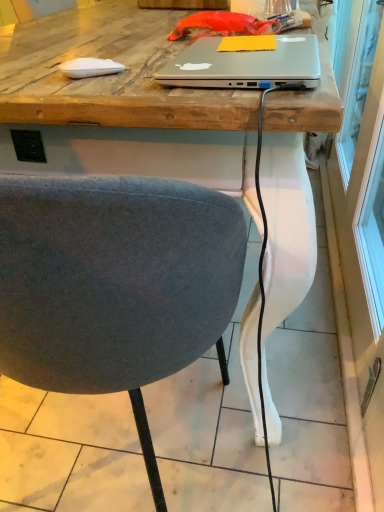
Question: Does textured gray chair at center come behind satin silver laptop at center?

Choices:
 (A) yes
 (B) no

Answer: (B)

Question: From a real-world perspective, does textured gray chair at center stand above satin silver laptop at center?

Choices:
 (A) no
 (B) yes

Answer: (A)

Question: Is textured gray chair at center to the left of satin silver laptop at center from the viewer's perspective?

Choices:
 (A) no
 (B) yes

Answer: (B)

Question: Is textured gray chair at center not within satin silver laptop at center?

Choices:
 (A) no
 (B) yes

Answer: (B)

Question: Does textured gray chair at center appear on the right side of satin silver laptop at center?

Choices:
 (A) no
 (B) yes

Answer: (A)

Question: Does point (288, 79) appear closer or farther from the camera than point (44, 247)?

Choices:
 (A) farther
 (B) closer

Answer: (A)

Question: From a real-world perspective, relative to textured gray chair at center, is satin silver laptop at center vertically above or below?

Choices:
 (A) below
 (B) above

Answer: (B)

Question: Considering their positions, is satin silver laptop at center located in front of or behind textured gray chair at center?

Choices:
 (A) front
 (B) behind

Answer: (B)

Question: Considering the positions of satin silver laptop at center and textured gray chair at center in the image, is satin silver laptop at center bigger or smaller than textured gray chair at center?

Choices:
 (A) small
 (B) big

Answer: (A)

Question: Does point (226, 68) appear closer or farther from the camera than point (364, 311)?

Choices:
 (A) farther
 (B) closer

Answer: (B)

Question: From their relative heights in the image, would you say satin silver laptop at center is taller or shorter than transparent glass screen door at right?

Choices:
 (A) short
 (B) tall

Answer: (A)

Question: Considering their positions, is satin silver laptop at center located in front of or behind transparent glass screen door at right?

Choices:
 (A) behind
 (B) front

Answer: (A)

Question: From a real-world perspective, is satin silver laptop at center above or below transparent glass screen door at right?

Choices:
 (A) above
 (B) below

Answer: (A)

Question: From a real-world perspective, is transparent glass screen door at right above or below satin silver laptop at center?

Choices:
 (A) above
 (B) below

Answer: (B)

Question: Do you think transparent glass screen door at right is within satin silver laptop at center, or outside of it?

Choices:
 (A) inside
 (B) outside

Answer: (B)